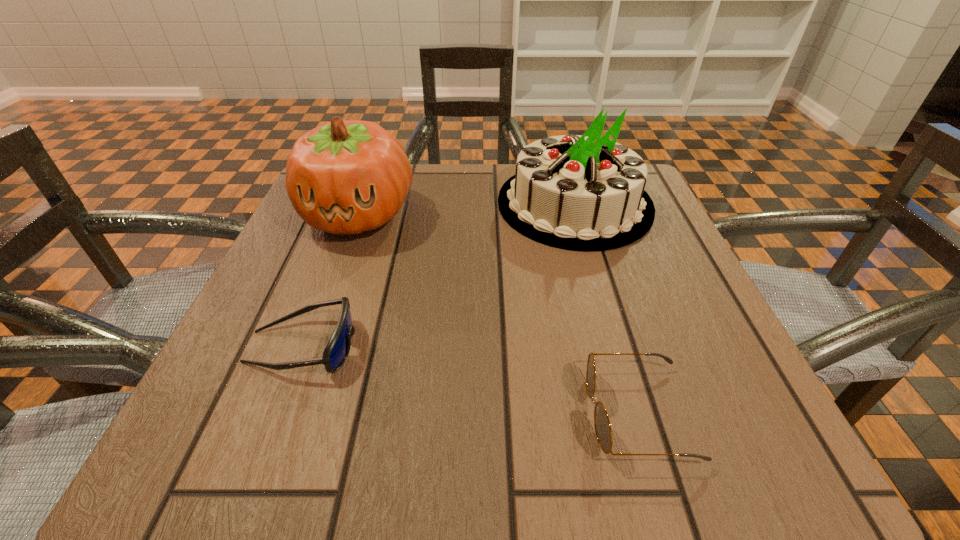
Find the location of a particular element. vacant area at the far edge of the desktop is located at coordinates click(441, 180).

Locate an element on the screen. The width and height of the screenshot is (960, 540). vacant space at the near edge of the desktop is located at coordinates (314, 461).

This screenshot has width=960, height=540. Find the location of `vacant point at the left edge`. vacant point at the left edge is located at coordinates (357, 249).

This screenshot has width=960, height=540. I want to click on vacant space at the right edge of the desktop, so click(x=666, y=322).

I want to click on free point at the near left corner, so click(300, 440).

Identify the location of free space at the near right corner of the desktop. (733, 434).

Locate an element on the screen. vacant area that lies between the left sunglasses and the right sunglasses is located at coordinates (470, 380).

Locate an element on the screen. This screenshot has height=540, width=960. vacant area that lies between the birthday cake and the left sunglasses is located at coordinates (439, 275).

Find the location of a particular element. blank region between the right sunglasses and the pumpkin is located at coordinates (498, 314).

In order to click on blank region between the left sunglasses and the pumpkin in this screenshot , I will do `click(330, 280)`.